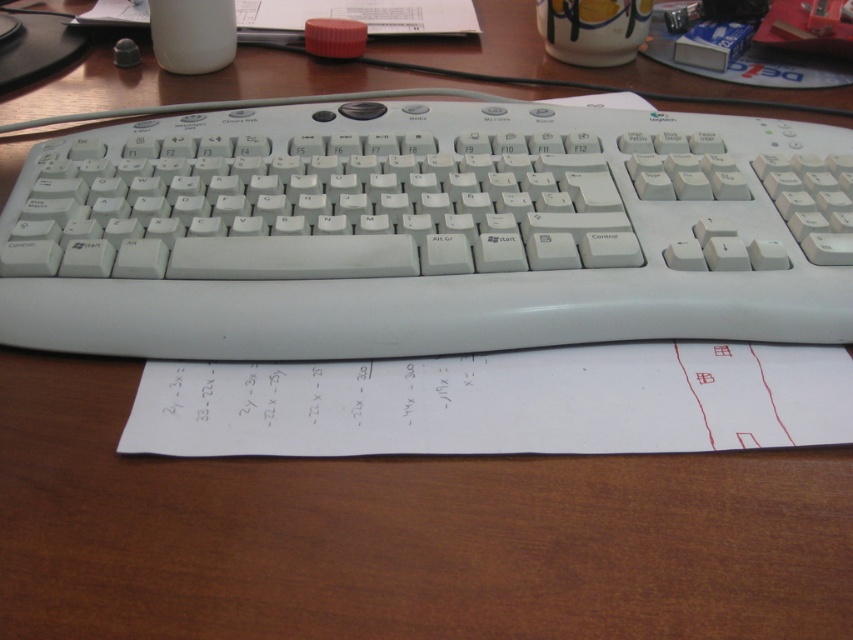
Question: In this image, where is white plastic keyboard at center located relative to white paper at lower center?

Choices:
 (A) left
 (B) right

Answer: (A)

Question: Is white plastic keyboard at center positioned in front of white paper at lower center?

Choices:
 (A) yes
 (B) no

Answer: (B)

Question: Which object is closer to the camera taking this photo?

Choices:
 (A) white paper at lower center
 (B) white plastic keyboard at center

Answer: (A)

Question: Is white plastic keyboard at center closer to the viewer compared to white paper at lower center?

Choices:
 (A) no
 (B) yes

Answer: (A)

Question: Which point is closer to the camera taking this photo?

Choices:
 (A) (54, 317)
 (B) (173, 385)

Answer: (B)